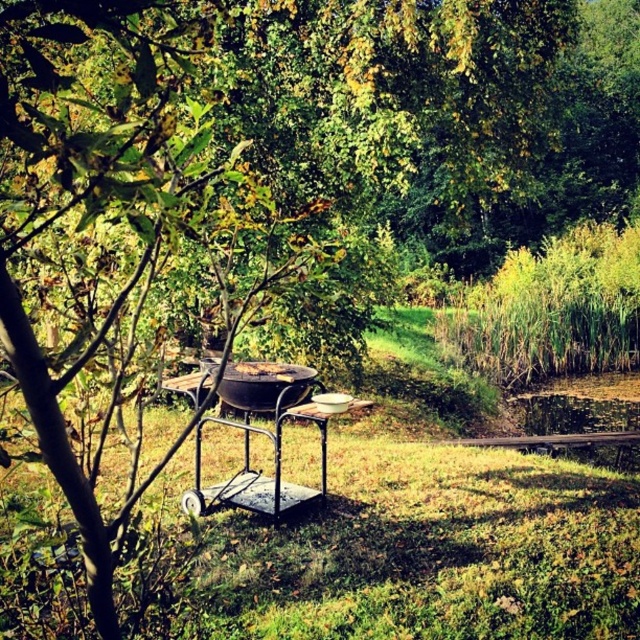
You are standing in the backyard and want to place a 3 meter long ladder from the barbecue grill to the point at coordinates point [307,390]. Can the ladder reach that point from the barbecue grill?

The point at coordinates point [307,390] is 5.97 meters away from the viewer, so the ladder would need to be at least 5.97 meters long to reach it. Since the ladder is only 3 meters long, it cannot reach the point from the barbecue grill.

From the picture: You are setting up a barbecue in the backyard and need to place the black matte grill at center and the brown matte grill at center close to each other. How far apart should you position them?

The black matte grill at center and the brown matte grill at center should be placed 3.36 inches apart.